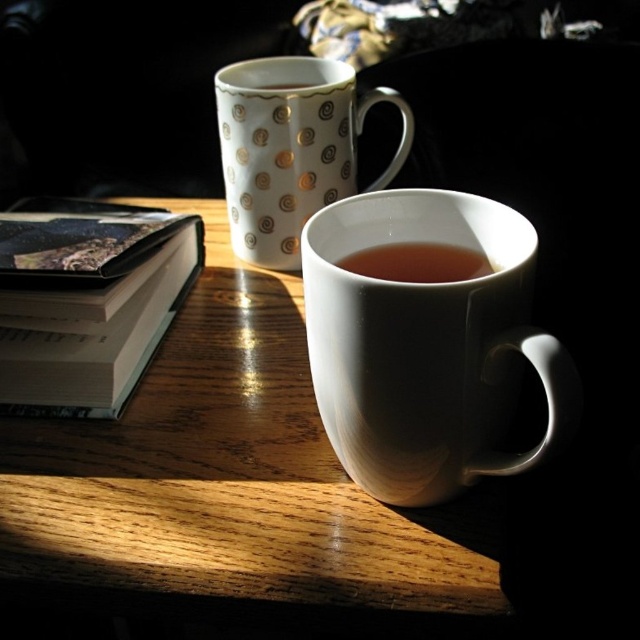
Question: Which of these objects is positioned closest to the hardcover book at left?

Choices:
 (A) gold textured mug at upper center
 (B) white glossy mug at center

Answer: (A)

Question: Is white glossy mug at center smaller than gold metallic swirls at upper left?

Choices:
 (A) yes
 (B) no

Answer: (B)

Question: Can you confirm if wooden table at center is bigger than translucent glass cup at center?

Choices:
 (A) yes
 (B) no

Answer: (A)

Question: Is wooden table at center to the left of gold textured mug at upper center from the viewer's perspective?

Choices:
 (A) yes
 (B) no

Answer: (A)

Question: Considering the real-world distances, which object is closest to the hardcover book at left?

Choices:
 (A) white glossy mug at center
 (B) wooden table at center

Answer: (B)

Question: Which of these objects is positioned closest to the gold metallic swirls at upper left?

Choices:
 (A) gold textured mug at upper center
 (B) translucent glass cup at center
 (C) wooden table at center

Answer: (A)